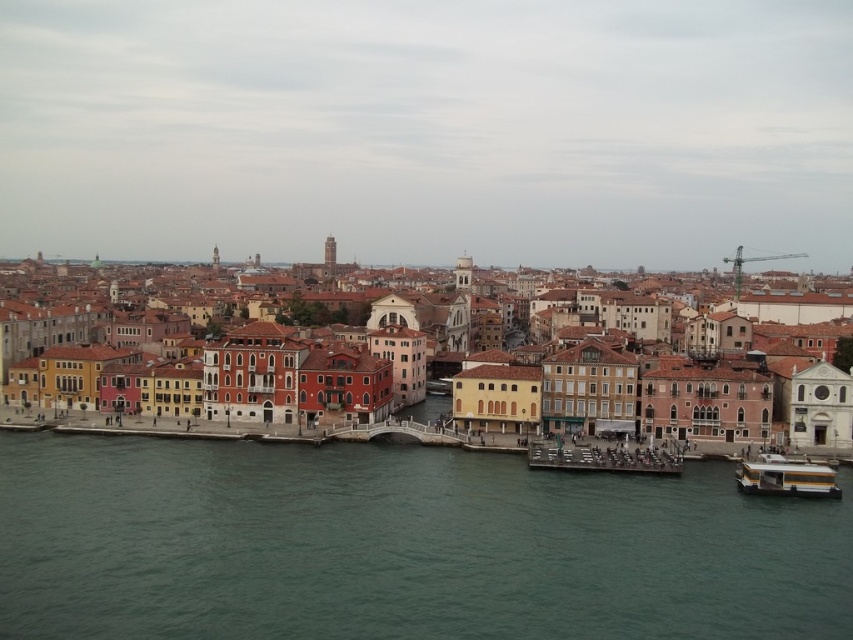
You are standing on the wooden dock at center and want to locate the matte orange building at center. According to the scene, in which direction should you look to see it?

The matte orange building at center is to the left of the wooden dock at center, so you should look to your left to see it.

You are standing at the edge of the dock in the cityscape and want to determine which of the two points, point 1 at coordinates point (x=572, y=307) or point 2 at coordinates point (x=759, y=483), is closer to you. Which point is closer?

Point 1 at coordinates point (x=572, y=307) is closer to you because it is further to the viewer than point 2 at coordinates point (x=759, y=483).

You are a tourist standing on the dock and want to take a photo of the matte orange building at center and the white glossy boat at lower right. Which object should you focus on first if you want to include both in your frame without moving your camera?

The matte orange building at center is bigger than the white glossy boat at lower right, so you should focus on the matte orange building at center first to ensure it fits properly in the frame before adjusting for the smaller boat.